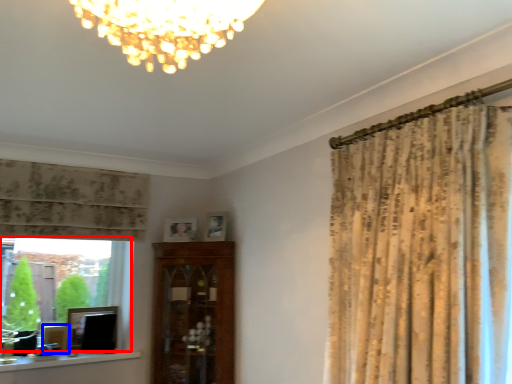
Question: Among these objects, which one is farthest to the camera, bay window (highlighted by a red box) or picture frame (highlighted by a blue box)?

Choices:
 (A) bay window
 (B) picture frame

Answer: (B)